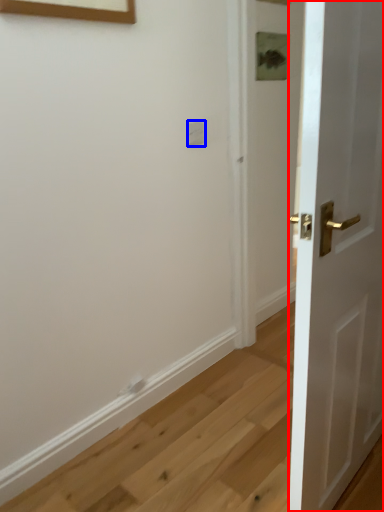
Question: Which point is further to the camera, door (highlighted by a red box) or electric outlet (highlighted by a blue box)?

Choices:
 (A) door
 (B) electric outlet

Answer: (B)